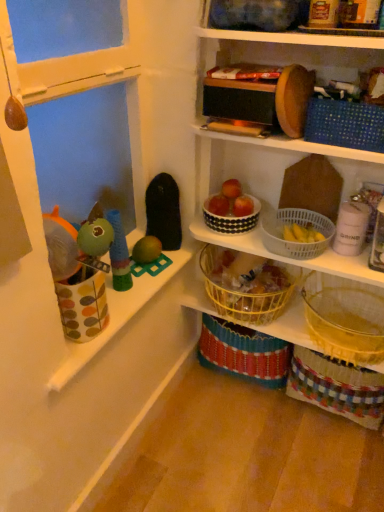
This screenshot has height=512, width=384. What are the coordinates of `vacant area that is in front of white matte container at upper right, arranged as the 5th toy when viewed from the left` in the screenshot? It's located at tap(356, 263).